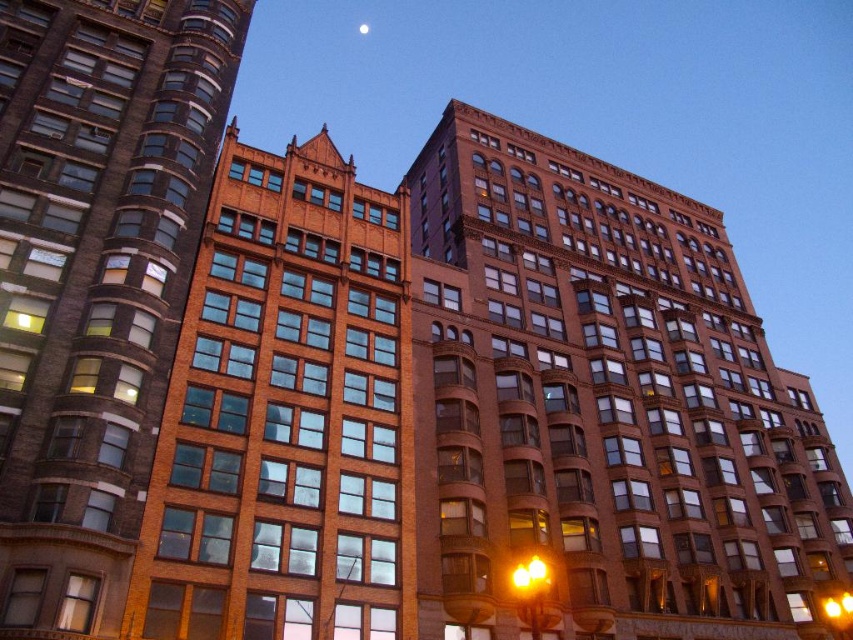
Question: Observing the image, what is the correct spatial positioning of brown brick building at center in reference to brick building at center?

Choices:
 (A) right
 (B) left

Answer: (A)

Question: Which object is positioned closest to the brick building at center?

Choices:
 (A) bright silver moon at upper center
 (B) brown brick building at center
 (C) brown brick building at left
 (D) yellow glass traffic light at center

Answer: (C)

Question: Which of the following is the closest to the observer?

Choices:
 (A) click(593, 589)
 (B) click(128, 275)
 (C) click(367, 26)

Answer: (B)

Question: Which object is the closest to the brick building at center?

Choices:
 (A) brown brick building at left
 (B) bright silver moon at upper center
 (C) brown brick building at center
 (D) yellow glass traffic light at center

Answer: (A)

Question: Is brown brick building at center to the left of brick building at center from the viewer's perspective?

Choices:
 (A) yes
 (B) no

Answer: (B)

Question: Can you confirm if brown brick building at center is wider than brown brick building at left?

Choices:
 (A) yes
 (B) no

Answer: (A)